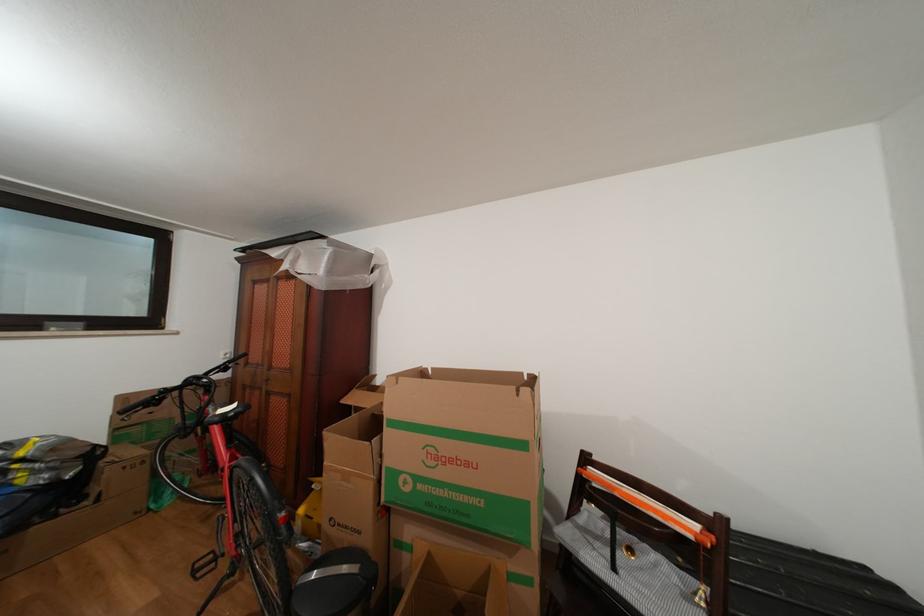
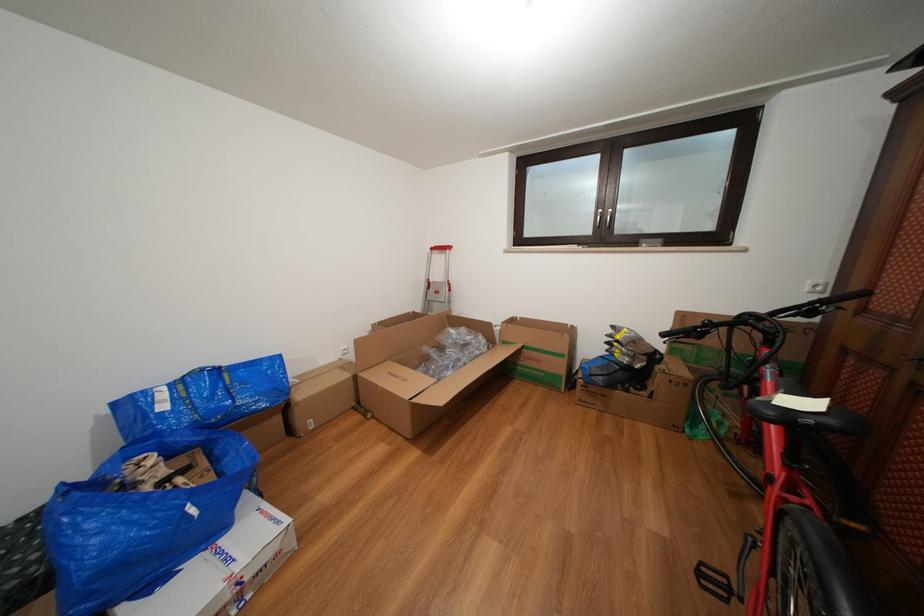
Question: I am providing you with two images of the same scene from different viewpoints. Which of the following objects are not visible in image2?

Choices:
 (A) black handlebar grip
 (B) blue and black bag
 (C) blue bag handle
 (D) none of these

Answer: (D)